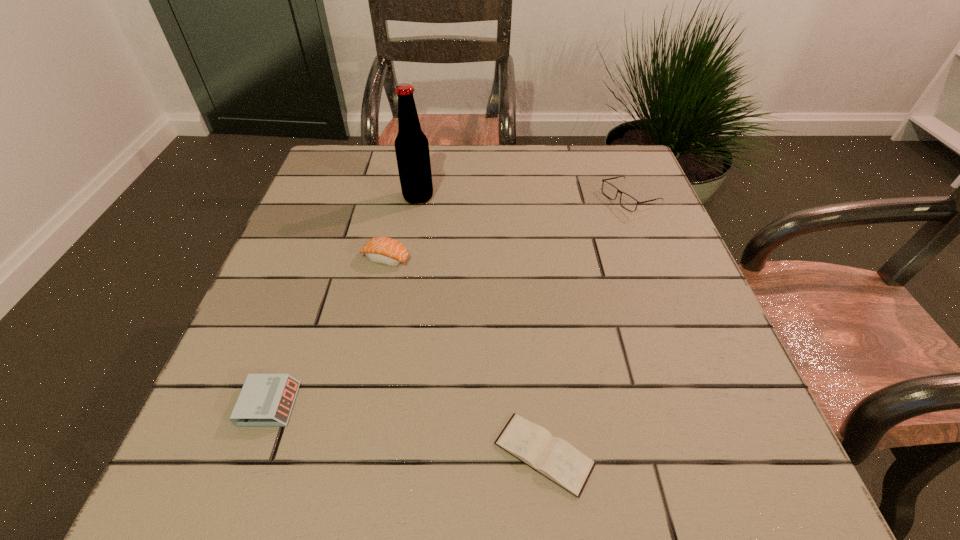
Where is `vacant space at the far edge of the desktop`? The image size is (960, 540). vacant space at the far edge of the desktop is located at coordinates (532, 146).

This screenshot has width=960, height=540. In the image, there is a desktop. What are the coordinates of `vacant space at the near edge` in the screenshot? It's located at (496, 478).

Locate an element on the screen. Image resolution: width=960 pixels, height=540 pixels. vacant space at the left edge of the desktop is located at coordinates (300, 235).

This screenshot has width=960, height=540. In the image, there is a desktop. Identify the location of vacant space at the right edge. (673, 291).

Where is `vacant region at the far left corner of the desktop`? The height and width of the screenshot is (540, 960). vacant region at the far left corner of the desktop is located at coordinates (313, 178).

Find the location of a particular element. vacant space at the far right corner of the desktop is located at coordinates (611, 154).

This screenshot has height=540, width=960. I want to click on free space at the near right corner, so click(674, 481).

Find the location of a particular element. empty location between the spectacles and the sushi is located at coordinates (508, 229).

Where is `vacant area that lies between the rightmost object and the third nearest object`? This screenshot has height=540, width=960. vacant area that lies between the rightmost object and the third nearest object is located at coordinates (508, 229).

This screenshot has width=960, height=540. I want to click on vacant space that is in between the rightmost object and the shortest object, so click(x=587, y=327).